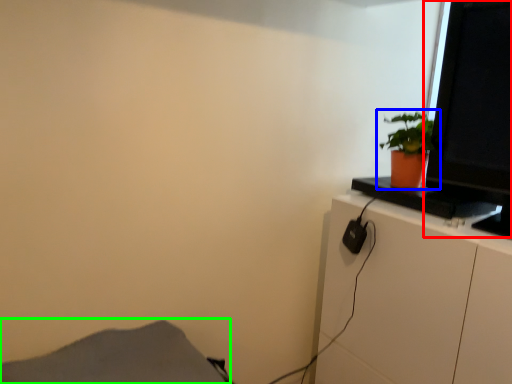
Question: Which is farther away from computer monitor (highlighted by a red box)? houseplant (highlighted by a blue box) or plain (highlighted by a green box)?

Choices:
 (A) houseplant
 (B) plain

Answer: (B)